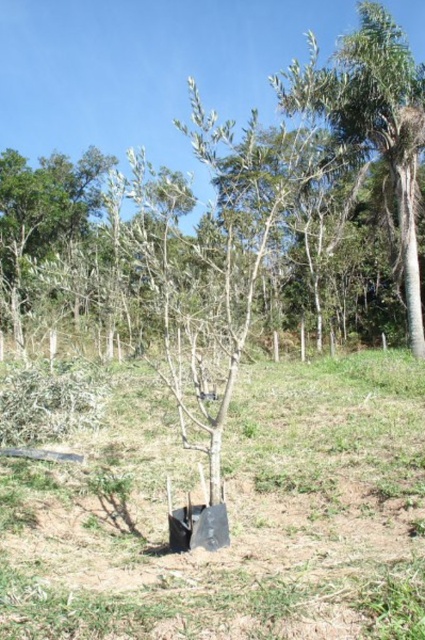
Who is more distant from viewer, (78,504) or (374,22)?

Result: Positioned behind is point (374,22).

Is point (144, 634) in front of point (410, 214)?

Yes.

Is point (345, 406) behind point (357, 35)?

No, it is not.

Locate an element on the screen. green grass at center is located at coordinates 229,513.